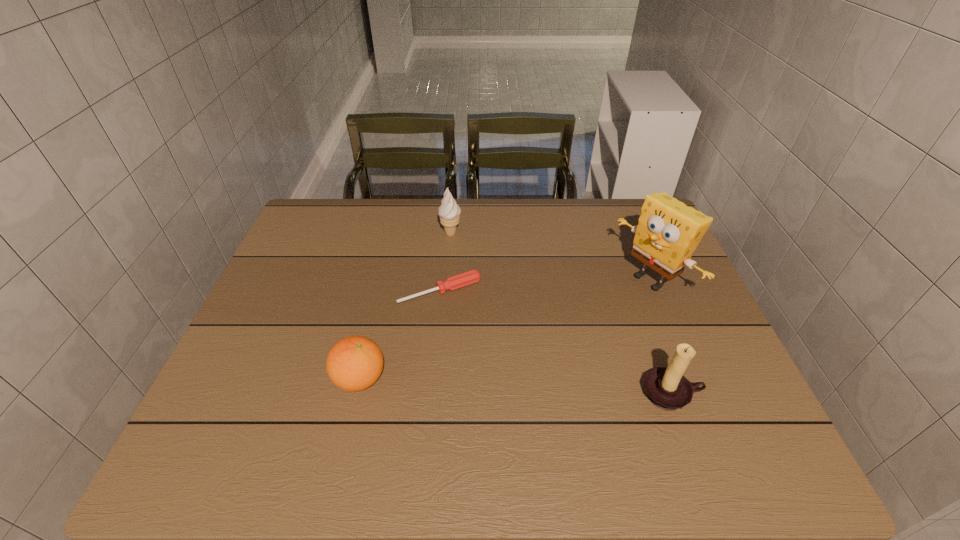
Where is `object present at the near right corner`? object present at the near right corner is located at coordinates (666, 387).

This screenshot has height=540, width=960. In order to click on vacant space at the far edge of the desktop in this screenshot , I will do `click(397, 240)`.

The height and width of the screenshot is (540, 960). In the image, there is a desktop. In order to click on vacant space at the near edge in this screenshot , I will do `click(608, 424)`.

In the image, there is a desktop. Where is `vacant space at the left edge`? The height and width of the screenshot is (540, 960). vacant space at the left edge is located at coordinates (245, 357).

In the image, there is a desktop. Where is `vacant space at the right edge`? Image resolution: width=960 pixels, height=540 pixels. vacant space at the right edge is located at coordinates (666, 280).

Identify the location of free region at the near left corner of the desktop. The width and height of the screenshot is (960, 540). (245, 398).

This screenshot has width=960, height=540. Identify the location of free space between the second shortest object and the candle holder. (516, 387).

This screenshot has width=960, height=540. I want to click on vacant space that's between the icecream and the shortest object, so click(445, 262).

Locate an element on the screen. The image size is (960, 540). free spot between the sponge and the icecream is located at coordinates (551, 257).

Locate an element on the screen. unoccupied area between the second shortest object and the sponge is located at coordinates [505, 329].